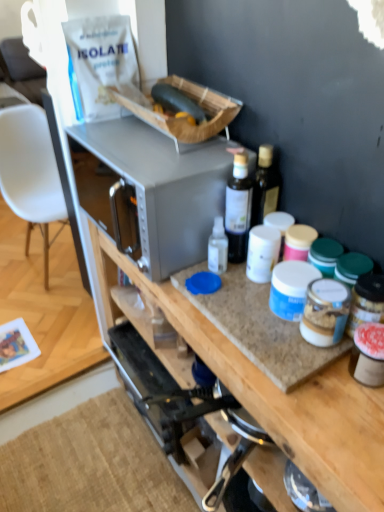
You are a GUI agent. You are given a task and a screenshot of the screen. Output one action in this format:
    pyautogui.click(x=<x>, y=<y>)
    Task: Click on the vacant space in front of white plastic chair at left
    
    Given the screenshot: What is the action you would take?
    pyautogui.click(x=44, y=305)